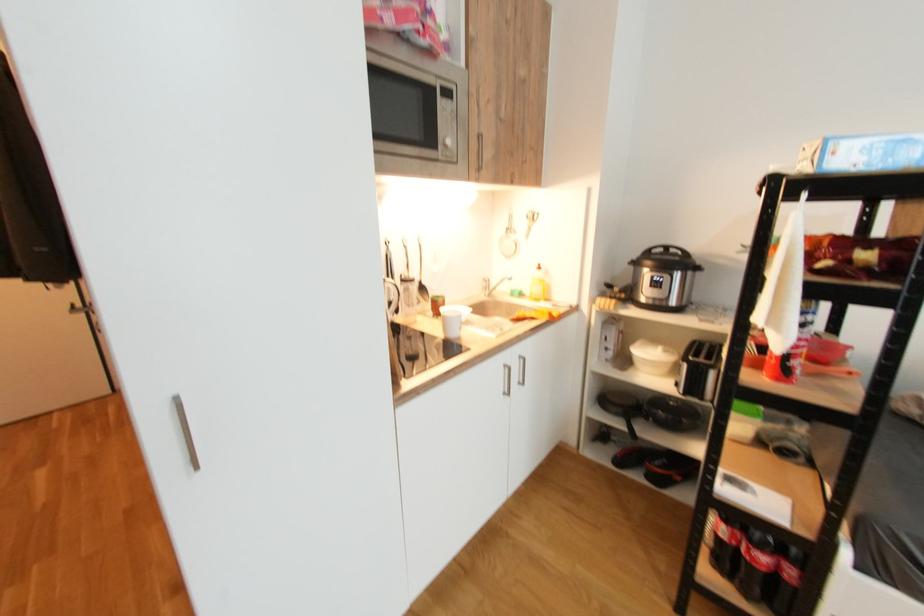
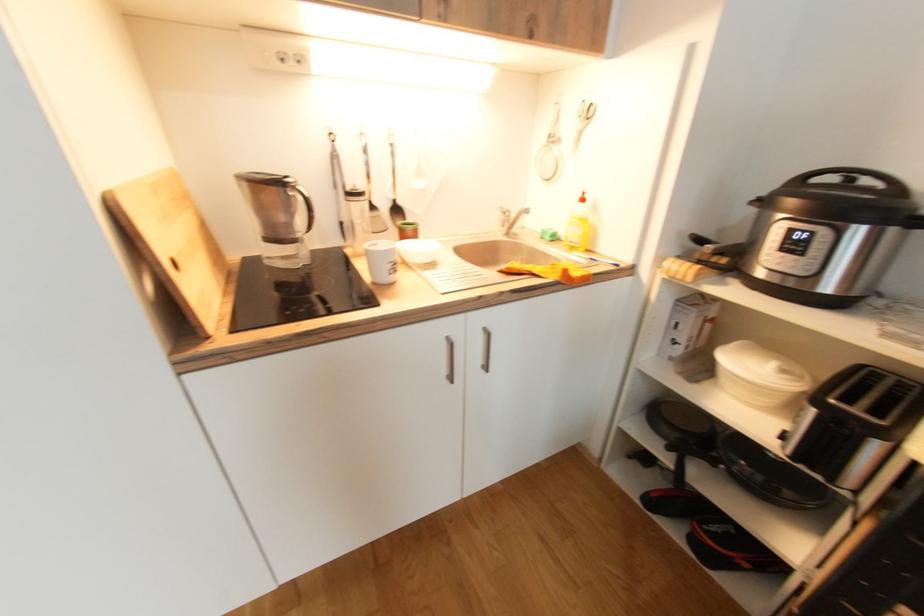
Question: The camera is either moving clockwise (left) or counter-clockwise (right) around the object. The first image is from the beginning of the video and the second image is from the end. Is the camera moving left or right when shooting the video?

Choices:
 (A) Left
 (B) Right

Answer: (B)